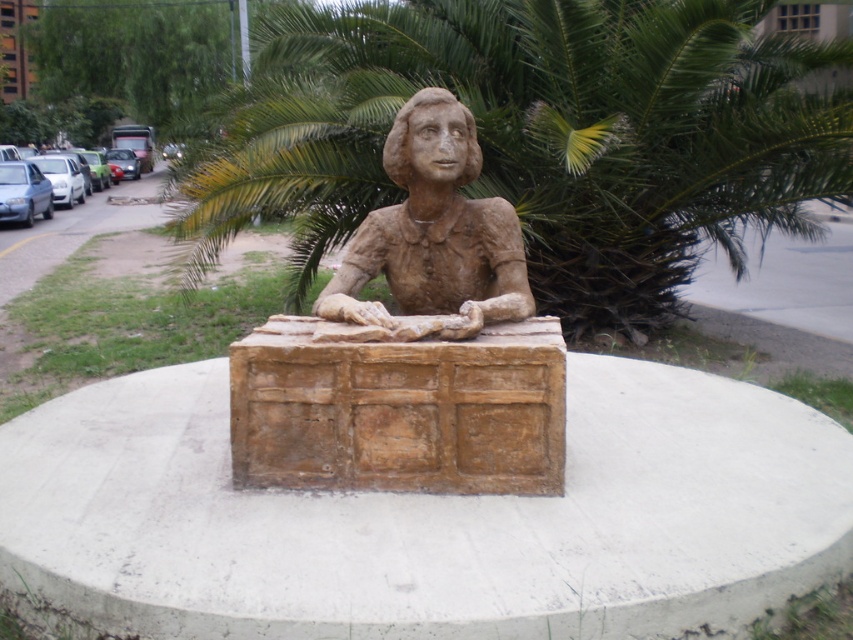
Between green leafy palm tree at center and brown clay bust at center, which one is positioned lower?

brown clay bust at center

Is point (730, 253) in front of point (445, 140)?

That is False.

Locate an element on the screen. green leafy palm tree at center is located at coordinates (537, 134).

Where is `green leafy palm tree at center`? green leafy palm tree at center is located at coordinates (537, 134).

Is matte bronze bust at center to the left of brown clay bust at center from the viewer's perspective?

Yes, matte bronze bust at center is to the left of brown clay bust at center.

I want to click on matte bronze bust at center, so click(x=410, y=346).

Between point (322, 300) and point (432, 109), which one is positioned in front?

Point (432, 109) is more forward.

The height and width of the screenshot is (640, 853). I want to click on matte bronze bust at center, so click(410, 346).

Which is in front, point (798, 577) or point (418, 176)?

Point (798, 577) is more forward.

Does brown textured cement at center have a smaller size compared to brown clay bust at center?

Actually, brown textured cement at center might be larger than brown clay bust at center.

Is point (604, 387) more distant than point (408, 252)?

Yes, it is behind point (408, 252).

The image size is (853, 640). Identify the location of brown textured cement at center. (427, 518).